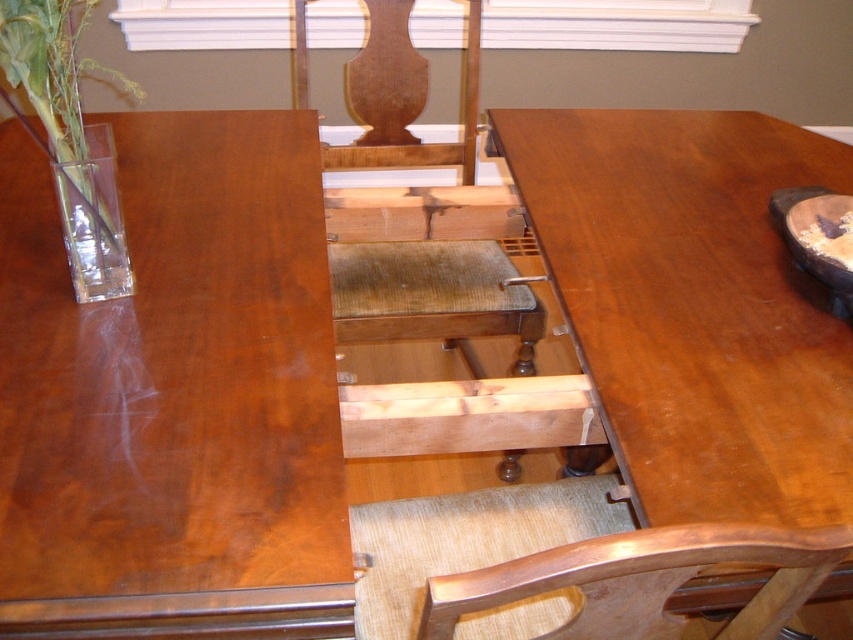
Which is behind, point (521, 564) or point (103, 216)?

Positioned behind is point (103, 216).

Is wooden textured chair back at center shorter than clear glass vase at left?

Yes.

Between point (631, 545) and point (74, 173), which one is positioned in front?

Positioned in front is point (631, 545).

In order to click on wooden textured chair back at center in this screenshot , I will do `click(643, 580)`.

Is glossy wood table at center smaller than wooden at center?

No.

Is point (624, 154) closer to camera compared to point (469, 164)?

That is True.

What do you see at coordinates (694, 305) in the screenshot? This screenshot has width=853, height=640. I see `glossy wood table at center` at bounding box center [694, 305].

Image resolution: width=853 pixels, height=640 pixels. Find the location of `glossy wood table at center`. glossy wood table at center is located at coordinates (694, 305).

Locate an element on the screen. glossy wood table at center is located at coordinates (694, 305).

Does glossy wood table at center have a lesser height compared to wooden textured chair back at center?

Incorrect, glossy wood table at center's height does not fall short of wooden textured chair back at center's.

Find the location of a particular element. The width and height of the screenshot is (853, 640). glossy wood table at center is located at coordinates (694, 305).